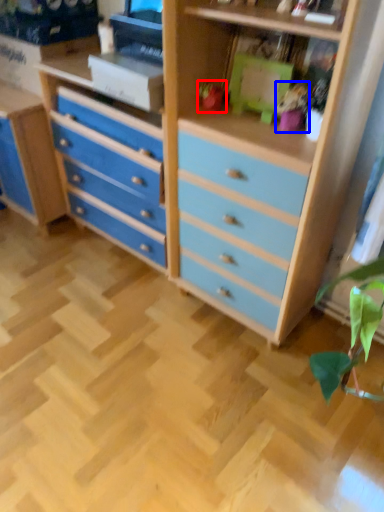
Question: Which of the following is the farthest to the observer, toy (highlighted by a red box) or toy (highlighted by a blue box)?

Choices:
 (A) toy
 (B) toy

Answer: (A)